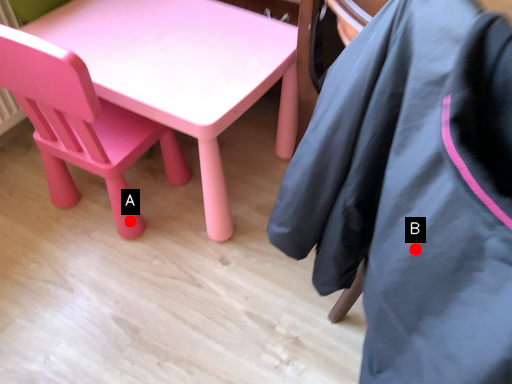
Question: Two points are circled on the image, labeled by A and B beside each circle. Which point is farther from the camera taking this photo?

Choices:
 (A) A is further
 (B) B is further

Answer: (A)